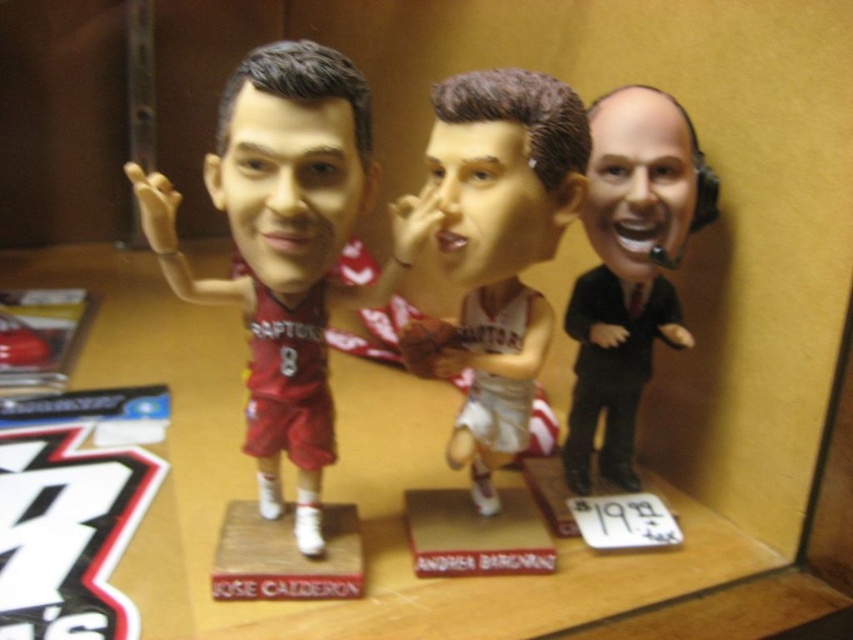
Question: Can you confirm if matte plastic bobblehead at center is positioned to the right of black suit at right?

Choices:
 (A) yes
 (B) no

Answer: (B)

Question: Among these objects, which one is farthest from the camera?

Choices:
 (A) matte plastic bobblehead at center
 (B) black suit at right

Answer: (B)

Question: Which of the following is the closest to the observer?

Choices:
 (A) pyautogui.click(x=299, y=481)
 (B) pyautogui.click(x=602, y=292)

Answer: (A)

Question: Is the position of matte plastic bobblehead at center less distant than that of black suit at right?

Choices:
 (A) no
 (B) yes

Answer: (B)

Question: Observing the image, what is the correct spatial positioning of matte plastic bobblehead at center in reference to black suit at right?

Choices:
 (A) left
 (B) right

Answer: (A)